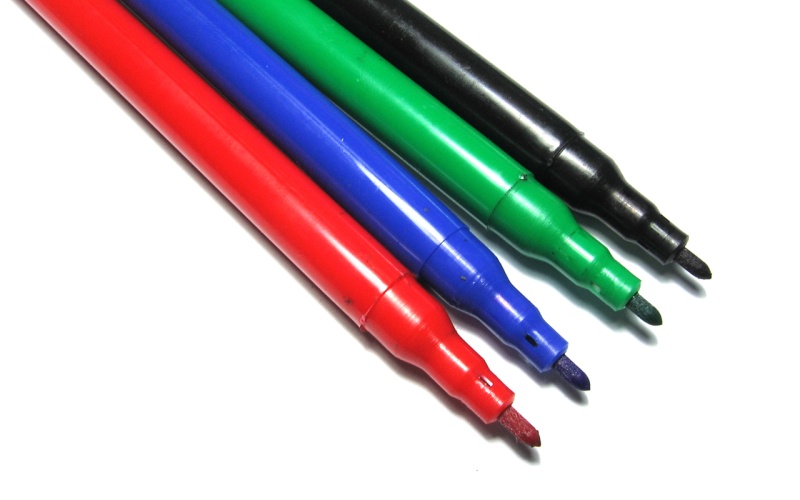
The height and width of the screenshot is (500, 800). I want to click on markers, so click(x=457, y=364), click(x=482, y=291), click(x=521, y=214), click(x=558, y=131).